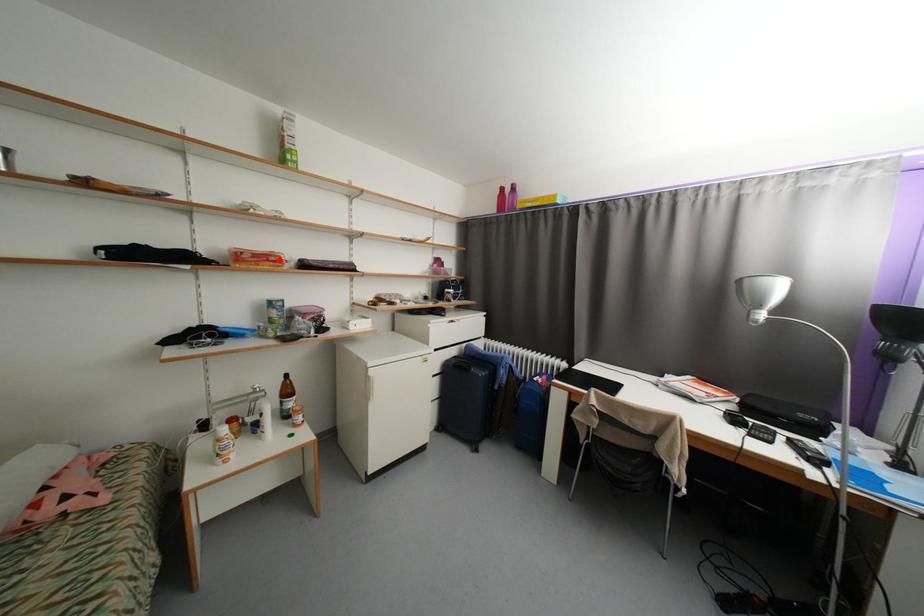
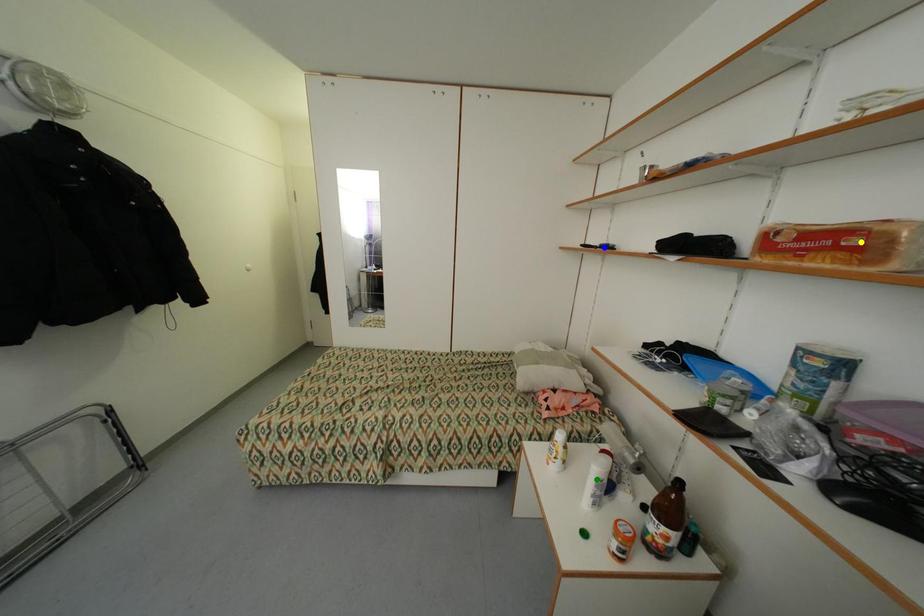
Question: I am providing you with two images of the same scene from different viewpoints. A red point is marked on the first image. You are given multiple points on the second image. Which point in image 2 represents the same 3d spot as the red point in image 1?

Choices:
 (A) yellow point
 (B) green point
 (C) blue point

Answer: (A)